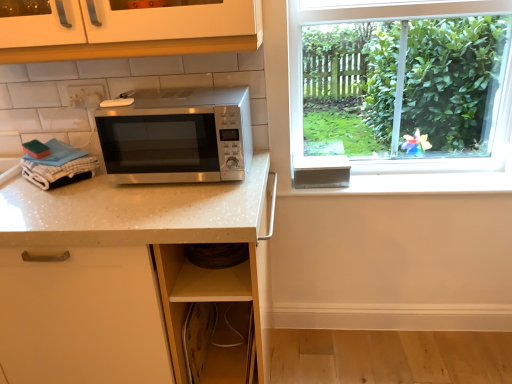
Image resolution: width=512 pixels, height=384 pixels. What do you see at coordinates (86, 95) in the screenshot? I see `white plastic electric outlet at upper left` at bounding box center [86, 95].

What are the coordinates of `white speckled quartz at center` in the screenshot? It's located at (134, 212).

Does point (88, 94) lie behind point (137, 158)?

Yes.

Is white plastic electric outlet at upper left at the left side of satin silver microwave at center?

Yes, white plastic electric outlet at upper left is to the left of satin silver microwave at center.

Is white plastic electric outlet at upper left placed right next to satin silver microwave at center?

No, white plastic electric outlet at upper left is not making contact with satin silver microwave at center.

From a real-world perspective, which object stands above the other?

From a 3D spatial view, white plastic electric outlet at upper left is above.

Between satin silver microwave at center and white speckled quartz at center, which one has more height?

white speckled quartz at center.

Between satin silver microwave at center and white speckled quartz at center, which one has larger width?

white speckled quartz at center is wider.

Locate an element on the screen. This screenshot has width=512, height=384. microwave oven on the right of white speckled quartz at center is located at coordinates (178, 136).

Is satin silver microwave at center at the left side of white speckled quartz at center?

In fact, satin silver microwave at center is to the right of white speckled quartz at center.

Can you confirm if satin silver microwave at center is smaller than white plastic electric outlet at upper left?

Incorrect, satin silver microwave at center is not smaller in size than white plastic electric outlet at upper left.

Which object is thinner, satin silver microwave at center or white plastic electric outlet at upper left?

With smaller width is white plastic electric outlet at upper left.

Is satin silver microwave at center facing away from white plastic electric outlet at upper left?

satin silver microwave at center is not turned away from white plastic electric outlet at upper left.

Where is `electric outlet to the left of satin silver microwave at center`? The image size is (512, 384). electric outlet to the left of satin silver microwave at center is located at coordinates (86, 95).

Could you tell me if white speckled quartz at center is facing satin silver microwave at center?

A: No, white speckled quartz at center is not aimed at satin silver microwave at center.

Can you confirm if white speckled quartz at center is shorter than satin silver microwave at center?

No, white speckled quartz at center is not shorter than satin silver microwave at center.

From the image's perspective, does white speckled quartz at center appear lower than satin silver microwave at center?

Yes, from the image's perspective, white speckled quartz at center is below satin silver microwave at center.

Would you say white speckled quartz at center is inside or outside satin silver microwave at center?

white speckled quartz at center is not enclosed by satin silver microwave at center.

Are white plastic electric outlet at upper left and white speckled quartz at center located far from each other?

That's not correct — white plastic electric outlet at upper left is a little close to white speckled quartz at center.

From a real-world perspective, is white plastic electric outlet at upper left on top of white speckled quartz at center?

Yes, from a real-world perspective, white plastic electric outlet at upper left is over white speckled quartz at center

Is white plastic electric outlet at upper left facing away from white speckled quartz at center?

That's not correct — white plastic electric outlet at upper left is not looking away from white speckled quartz at center.

Find the location of a particular element. electric outlet on the left of white speckled quartz at center is located at coordinates (86, 95).

Which point is more distant from viewer, (x=238, y=221) or (x=84, y=98)?

The point (x=84, y=98) is behind.

This screenshot has width=512, height=384. In the image, there is a white speckled quartz at center. What are the coordinates of `electric outlet above it (from the image's perspective)` in the screenshot? It's located at (86, 95).

Is white speckled quartz at center further to the viewer compared to white plastic electric outlet at upper left?

That is False.

From the image's perspective, is white speckled quartz at center under white plastic electric outlet at upper left?

Yes, from the image's perspective, white speckled quartz at center is below white plastic electric outlet at upper left.

Where is `microwave oven lying in front of the white plastic electric outlet at upper left`? Image resolution: width=512 pixels, height=384 pixels. microwave oven lying in front of the white plastic electric outlet at upper left is located at coordinates (178, 136).

This screenshot has height=384, width=512. I want to click on microwave oven that appears above the white speckled quartz at center (from a real-world perspective), so click(x=178, y=136).

Looking at the image, which one is located further to white speckled quartz at center, white plastic electric outlet at upper left or satin silver microwave at center?

Among the two, white plastic electric outlet at upper left is located further to white speckled quartz at center.

Based on their spatial positions, is satin silver microwave at center or white plastic electric outlet at upper left further from white speckled quartz at center?

white plastic electric outlet at upper left is further to white speckled quartz at center.

In the scene shown: Estimate the real-world distances between objects in this image. Which object is further from satin silver microwave at center, white plastic electric outlet at upper left or white speckled quartz at center?

white plastic electric outlet at upper left is positioned further to the anchor satin silver microwave at center.

Which object lies further to the anchor point satin silver microwave at center, white speckled quartz at center or white plastic electric outlet at upper left?

white plastic electric outlet at upper left.

Considering their positions, is white speckled quartz at center positioned closer to white plastic electric outlet at upper left than satin silver microwave at center?

The object closer to white plastic electric outlet at upper left is satin silver microwave at center.

Based on their spatial positions, is satin silver microwave at center or white speckled quartz at center closer to white plastic electric outlet at upper left?

satin silver microwave at center.

Locate an element on the screen. This screenshot has height=384, width=512. microwave oven between white plastic electric outlet at upper left and white speckled quartz at center from top to bottom is located at coordinates (178, 136).